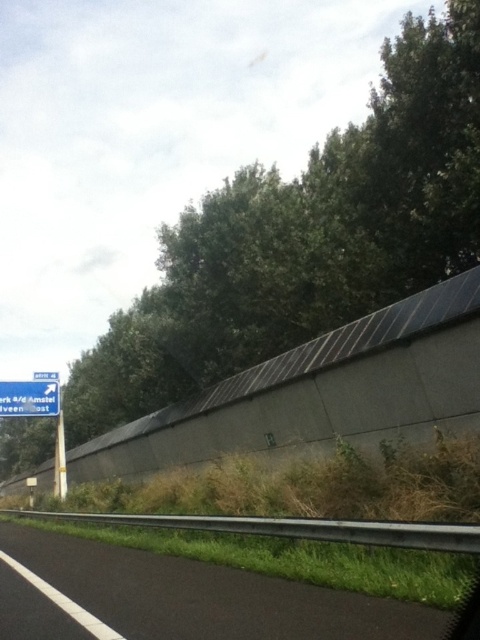
Does black asphalt highway at lower left come behind blue plastic sign at left?

No, it is in front of blue plastic sign at left.

Does black asphalt highway at lower left have a lesser width compared to blue plastic sign at left?

No, black asphalt highway at lower left is not thinner than blue plastic sign at left.

Which is in front, point (44, 632) or point (33, 404)?

Point (44, 632) is more forward.

The width and height of the screenshot is (480, 640). What are the coordinates of `black asphalt highway at lower left` in the screenshot? It's located at (193, 598).